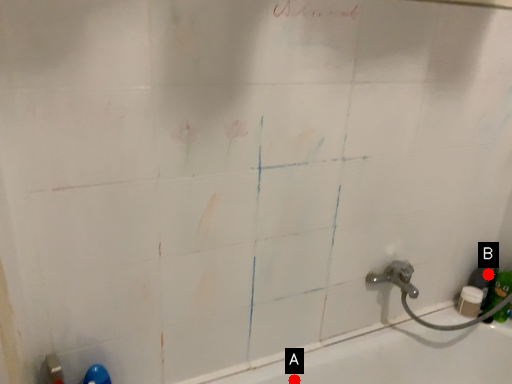
Question: Two points are circled on the image, labeled by A and B beside each circle. Which of the following is the closest to the observer?

Choices:
 (A) A is closer
 (B) B is closer

Answer: (A)